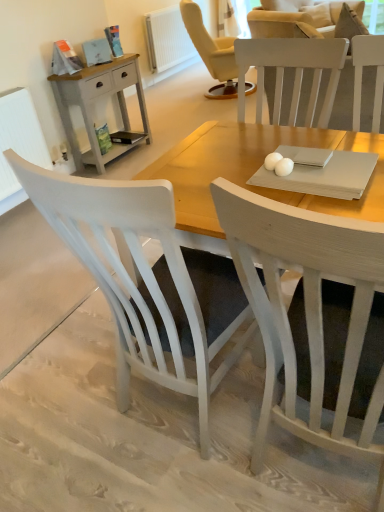
Locate an element on the screen. free space that is to the left of white wood chair at center, positioned as the first chair in left-to-right order is located at coordinates [65, 407].